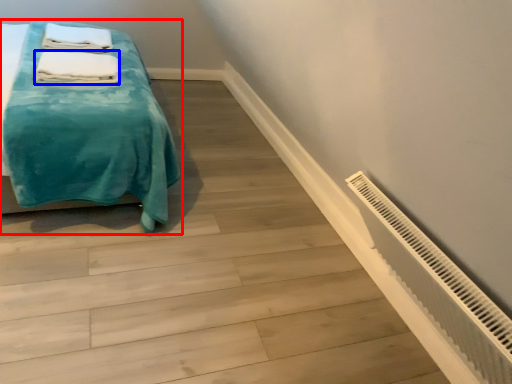
Question: Which object appears closest to the camera in this image, bed (highlighted by a red box) or bath towel (highlighted by a blue box)?

Choices:
 (A) bed
 (B) bath towel

Answer: (A)